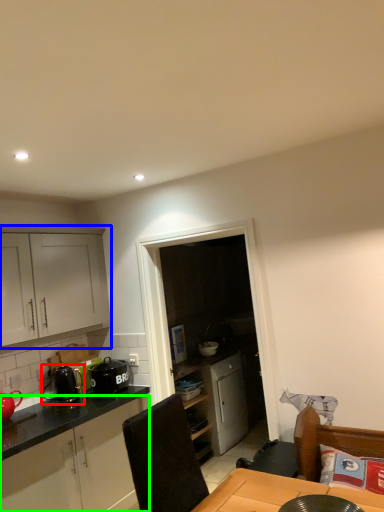
Question: Based on their relative distances, which object is farther from appliance (highlighted by a red box)? Choose from cabinetry (highlighted by a blue box) and cabinetry (highlighted by a green box).

Choices:
 (A) cabinetry
 (B) cabinetry

Answer: (A)